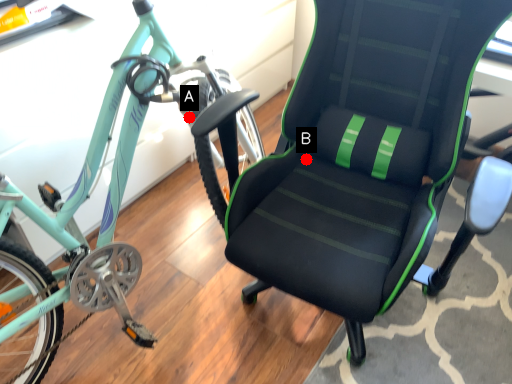
Question: Two points are circled on the image, labeled by A and B beside each circle. Which point is closer to the camera taking this photo?

Choices:
 (A) A is closer
 (B) B is closer

Answer: (A)